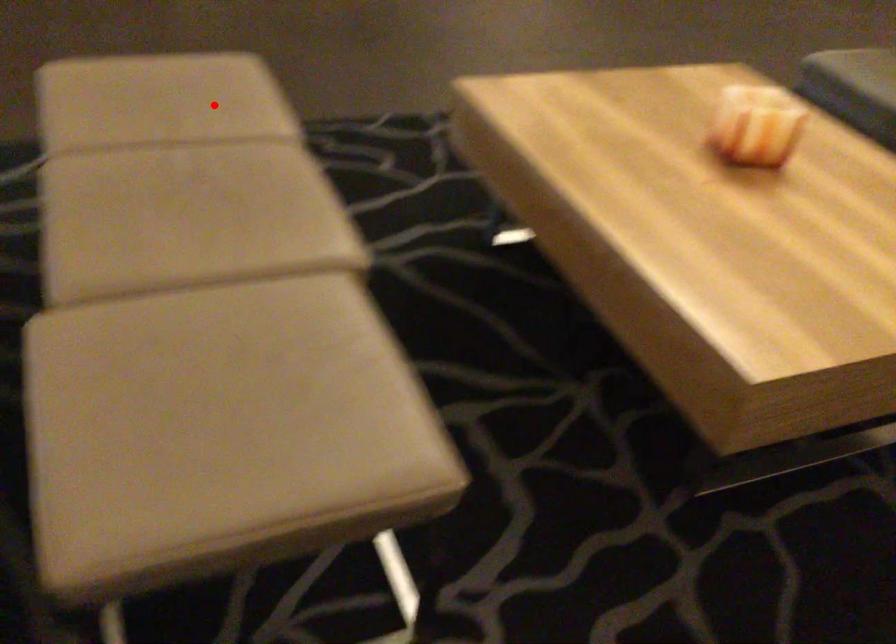
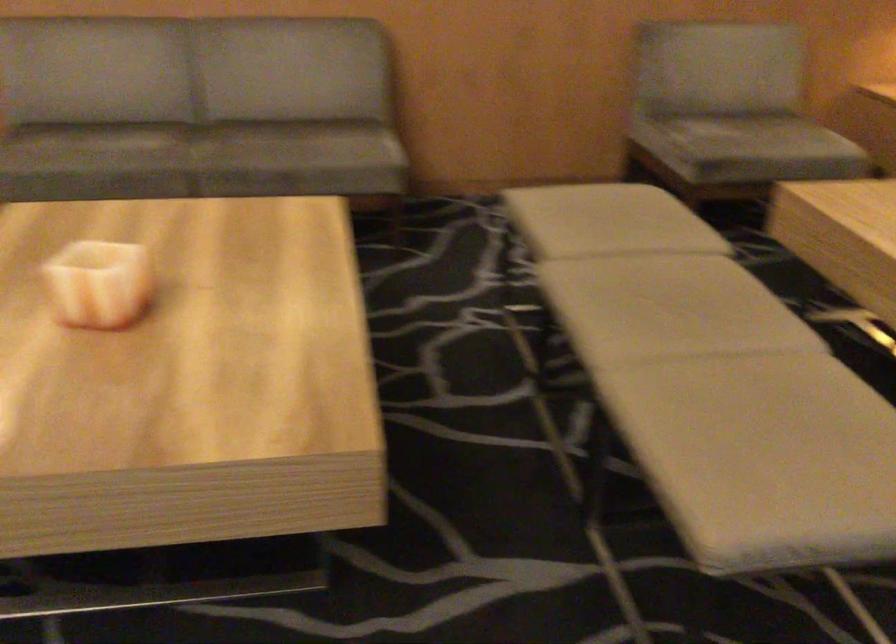
Question: I am providing you with two images of the same scene from different viewpoints. A red point is marked on the first image. Can you still see the location of the red point in image 2?

Choices:
 (A) Yes
 (B) No

Answer: (A)